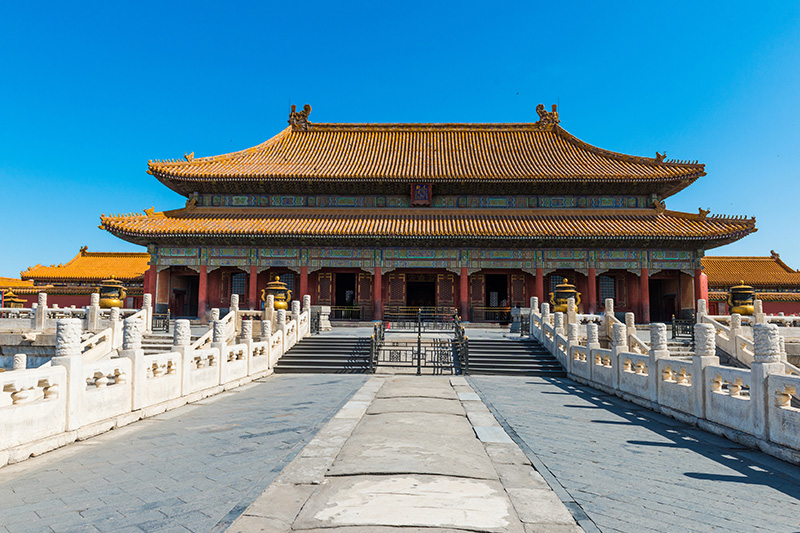
At what (x,y) coordinates should I click in order to perform the action: click on entrance. Please return your answer as a coordinate pair (x, y). Image resolution: width=800 pixels, height=533 pixels. Looking at the image, I should click on (420, 300), (340, 295), (498, 296).